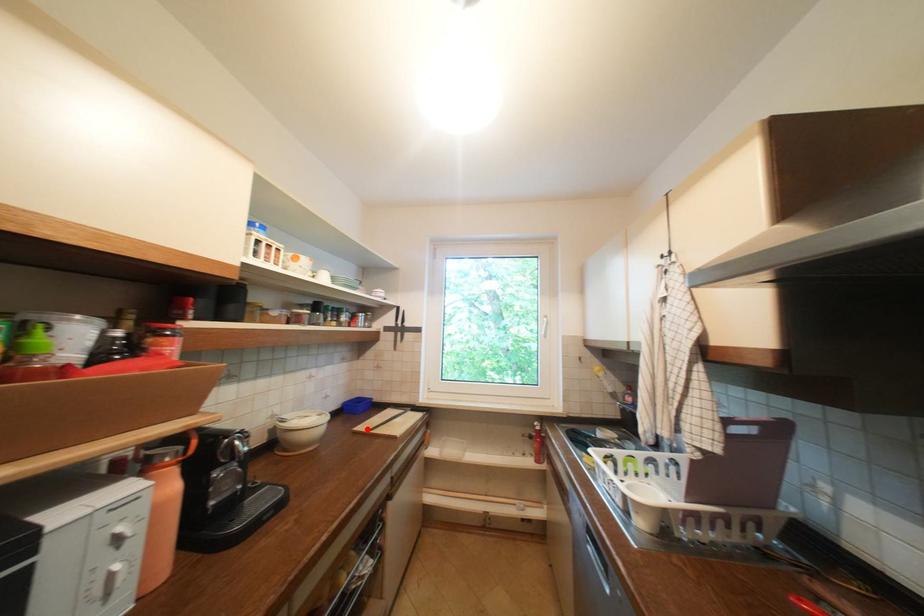
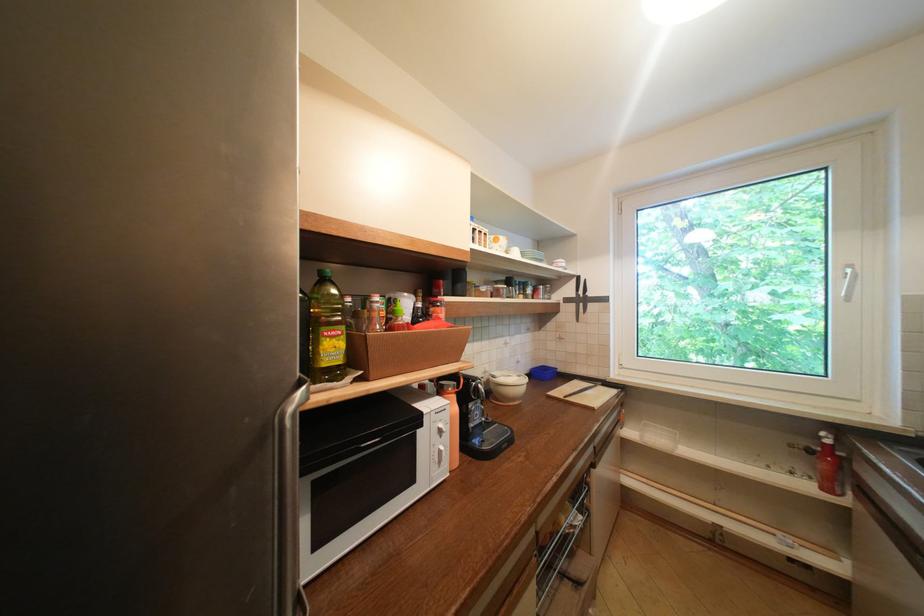
Question: I am providing you with two images of the same scene from different viewpoints. A red point is marked on the first image. Is the red point's position out of view in image 2?

Choices:
 (A) Yes
 (B) No

Answer: (B)